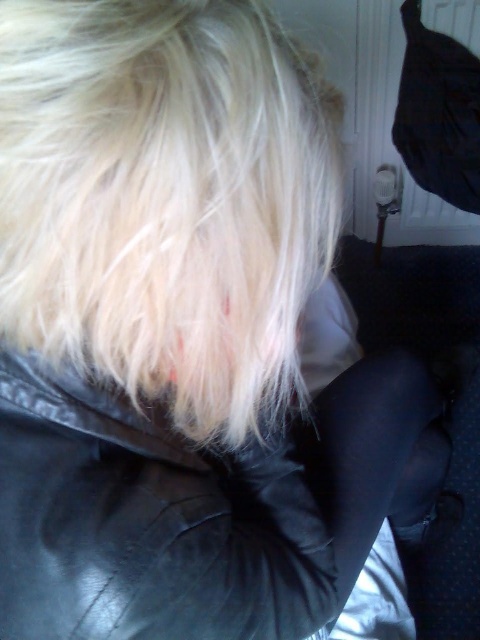
Question: Which point is farther from the camera taking this photo?

Choices:
 (A) (312, 531)
 (B) (73, 285)

Answer: (A)

Question: Does blonde hair at upper center appear under black leather jacket at center?

Choices:
 (A) yes
 (B) no

Answer: (B)

Question: Is blonde hair at upper center to the right of black leather jacket at center from the viewer's perspective?

Choices:
 (A) no
 (B) yes

Answer: (B)

Question: Can you confirm if blonde hair at upper center is positioned below black leather jacket at center?

Choices:
 (A) no
 (B) yes

Answer: (A)